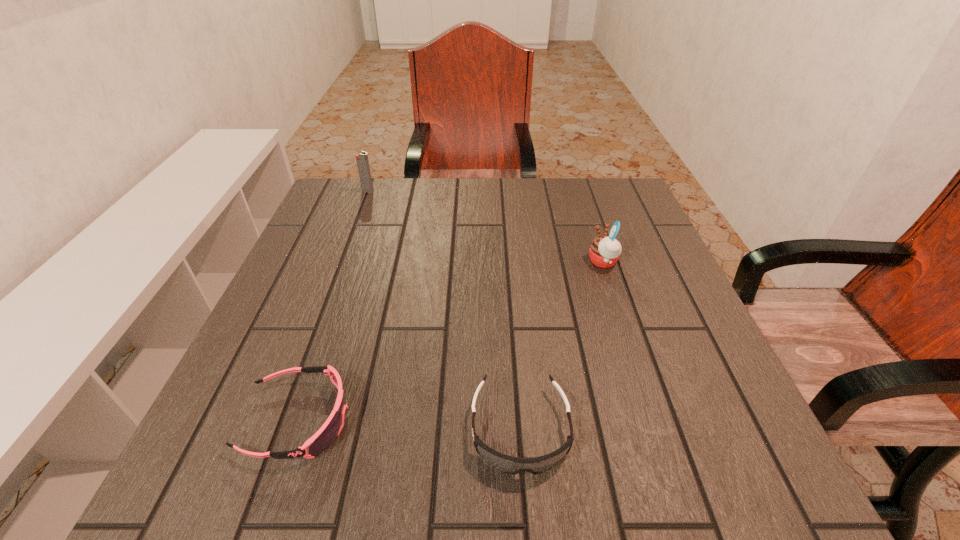
Find the location of a particular element. Image resolution: width=960 pixels, height=540 pixels. object positioned at the far edge is located at coordinates (362, 161).

Locate an element on the screen. igniter that is at the left edge is located at coordinates (362, 161).

Identify the location of goggles located at the left edge. (323, 438).

Identify the location of object situated at the right edge. (605, 251).

Where is `object that is positioned at the far left corner`? Image resolution: width=960 pixels, height=540 pixels. object that is positioned at the far left corner is located at coordinates (362, 161).

Identify the location of object situated at the near left corner. (323, 438).

Where is `vacant space at the far edge of the desktop`? The width and height of the screenshot is (960, 540). vacant space at the far edge of the desktop is located at coordinates (525, 188).

Locate an element on the screen. vacant region at the near edge of the desktop is located at coordinates (670, 502).

Find the location of a particular element. The width and height of the screenshot is (960, 540). free spot at the left edge of the desktop is located at coordinates (366, 247).

Locate an element on the screen. free space at the right edge of the desktop is located at coordinates (646, 321).